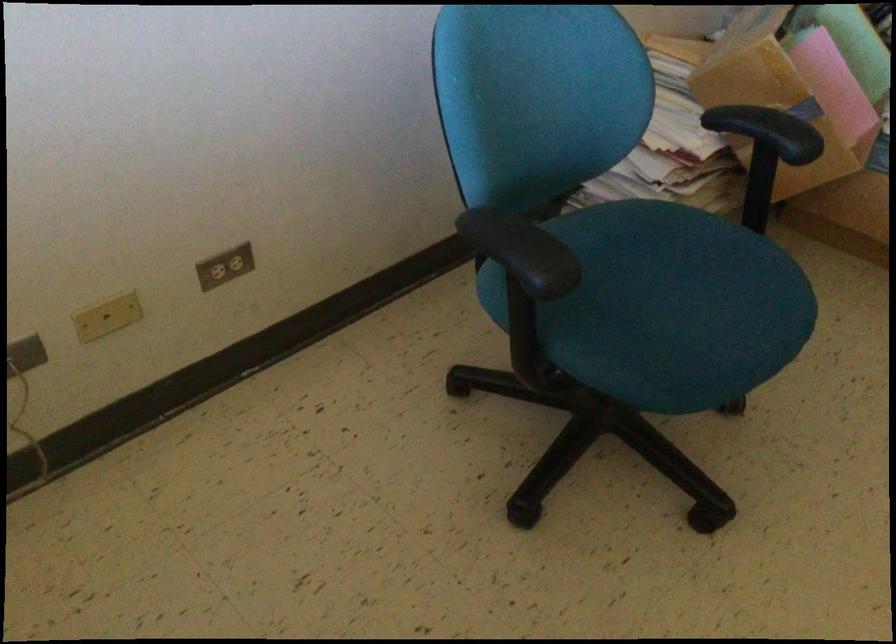
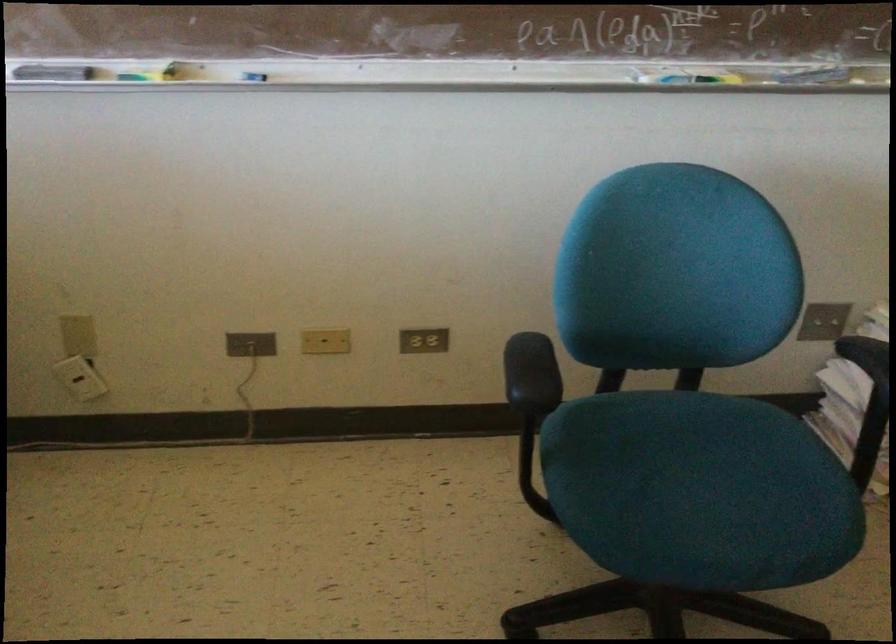
In the second image, find the point that corresponds to (x=543, y=257) in the first image.

(531, 374)